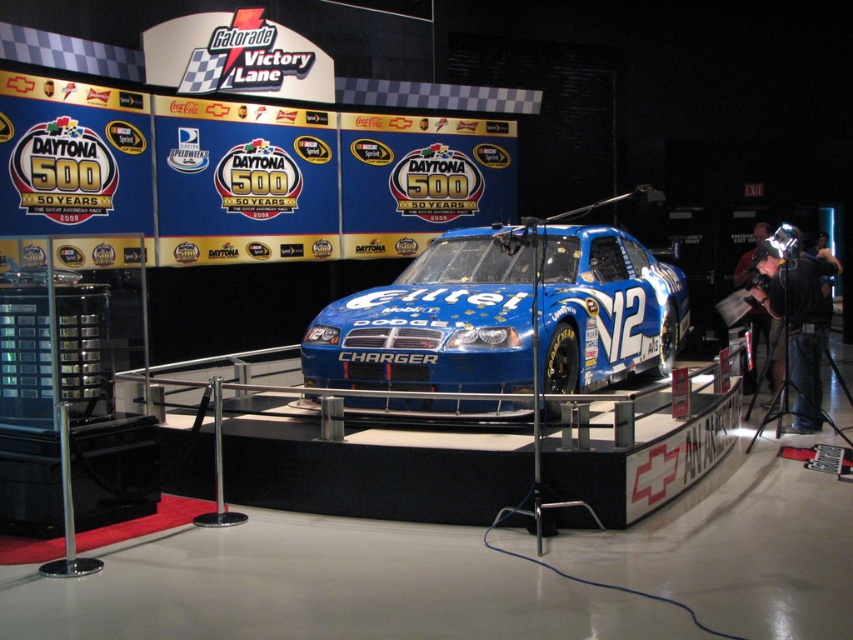
Looking at this image, you are a photographer at the Daytona 500 event and you see the black fabric camera at right and the black leather jacket at right. Which object is taller?

The black fabric camera at right is much taller than the black leather jacket at right.

You are a photographer holding the black fabric camera at right and want to take a photo of the blue glossy charger at center. Considering the camera can capture objects up to 1.2 meters wide, will the charger fit in the frame?

The blue glossy charger at center might be wider than the black fabric camera at right, but since the camera can capture up to 1.2 meters, we need to know the charger width. However, the description only states it might be wider than the camera, not its exact size. Therefore, it is uncertain if it will fit.

You are a photographer at the Daytona 500 event and need to position your equipment. You have a black fabric camera at right and a black leather jacket at right. According to the scene, which item is positioned more to the right side?

The black fabric camera at right is positioned more to the right side than the black leather jacket at right.